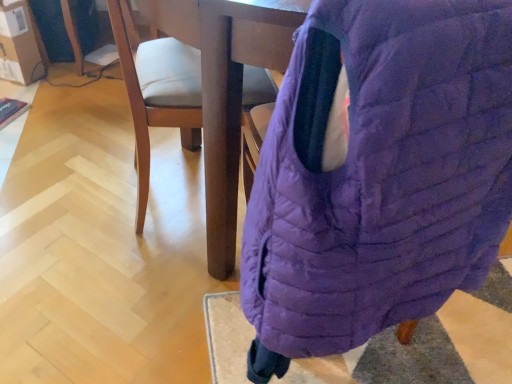
In order to click on vacant region to the left of purple quilted bean bag chair at center in this screenshot , I will do `click(134, 311)`.